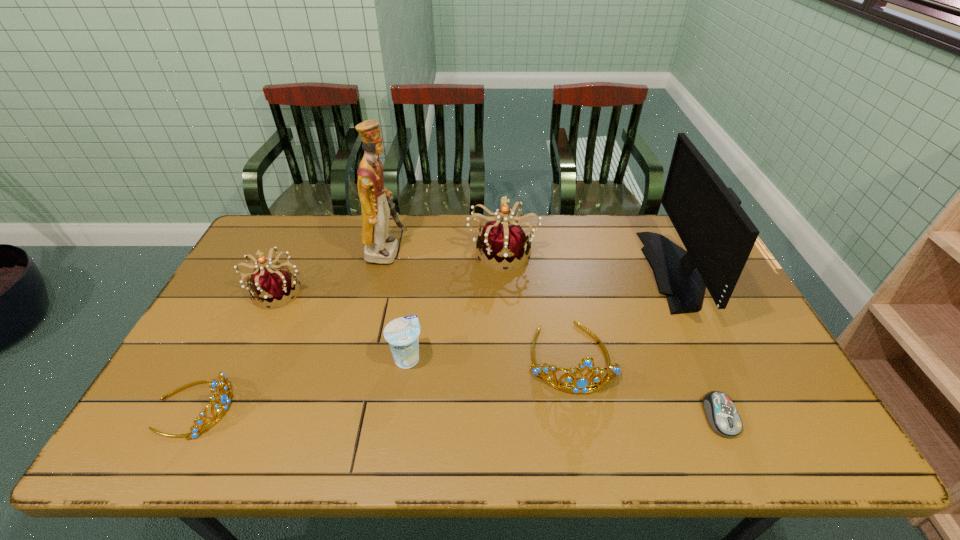
At what (x,y) coordinates should I click in order to perform the action: click on the tallest object. Please return your answer as a coordinate pair (x, y). The height and width of the screenshot is (540, 960). Looking at the image, I should click on (380, 248).

This screenshot has height=540, width=960. I want to click on nutcracker, so click(x=380, y=248).

You are a GUI agent. You are given a task and a screenshot of the screen. Output one action in this format:
    pyautogui.click(x=<x>, y=<y>)
    Task: Click on the monitor
    This screenshot has height=540, width=960.
    Given the screenshot: What is the action you would take?
    pyautogui.click(x=718, y=235)

This screenshot has width=960, height=540. In order to click on the bigger red tiara in this screenshot , I will do `click(503, 243)`.

I want to click on the third tallest object, so click(x=503, y=243).

Locate an element on the screen. Image resolution: width=960 pixels, height=540 pixels. the left red tiara is located at coordinates (270, 285).

At what (x,y) coordinates should I click in order to perform the action: click on the third shortest tiara. Please return your answer as a coordinate pair (x, y). The width and height of the screenshot is (960, 540). Looking at the image, I should click on (270, 285).

Find the location of a particular element. This screenshot has width=960, height=540. the fifth tallest object is located at coordinates (582, 384).

Where is `the bigger gold tiara`? Image resolution: width=960 pixels, height=540 pixels. the bigger gold tiara is located at coordinates (582, 384).

Find the location of a particular element. yogurt is located at coordinates (402, 334).